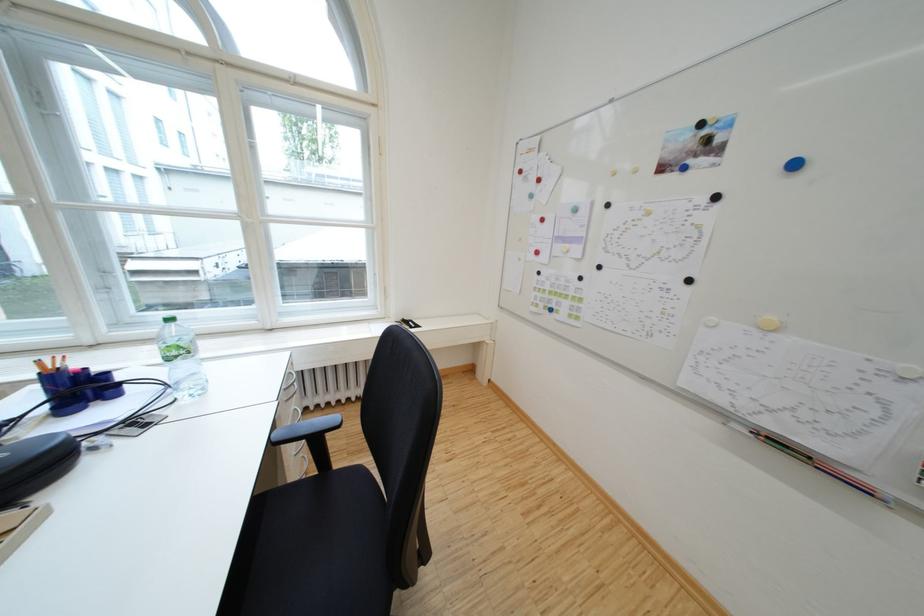
Describe the element at coordinates (782, 446) in the screenshot. The width and height of the screenshot is (924, 616). I see `the orange pencil` at that location.